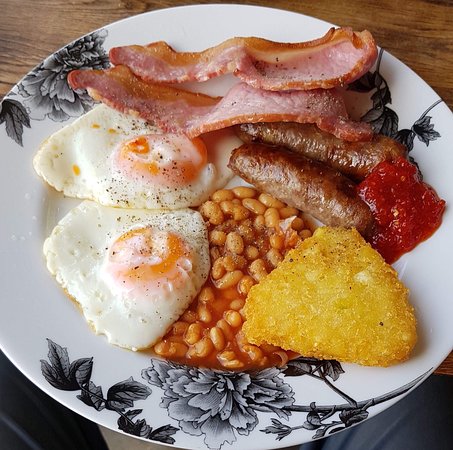
Where is `plate`? plate is located at coordinates (18, 203), (439, 277), (208, 15).